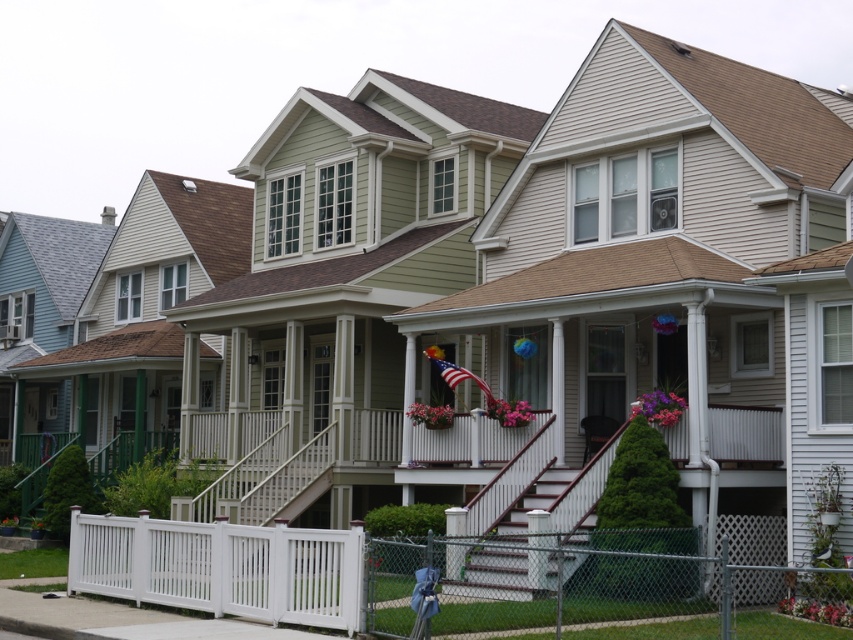
Can you confirm if white vinyl fence at lower left is taller than white wooden stairs at center?

In fact, white vinyl fence at lower left may be shorter than white wooden stairs at center.

Is white vinyl fence at lower left positioned at the back of white wooden stairs at center?

No, white vinyl fence at lower left is in front of white wooden stairs at center.

Does point (462, 600) come farther from viewer compared to point (546, 525)?

That is False.

Identify the location of white vinyl fence at lower left. This screenshot has width=853, height=640. (451, 579).